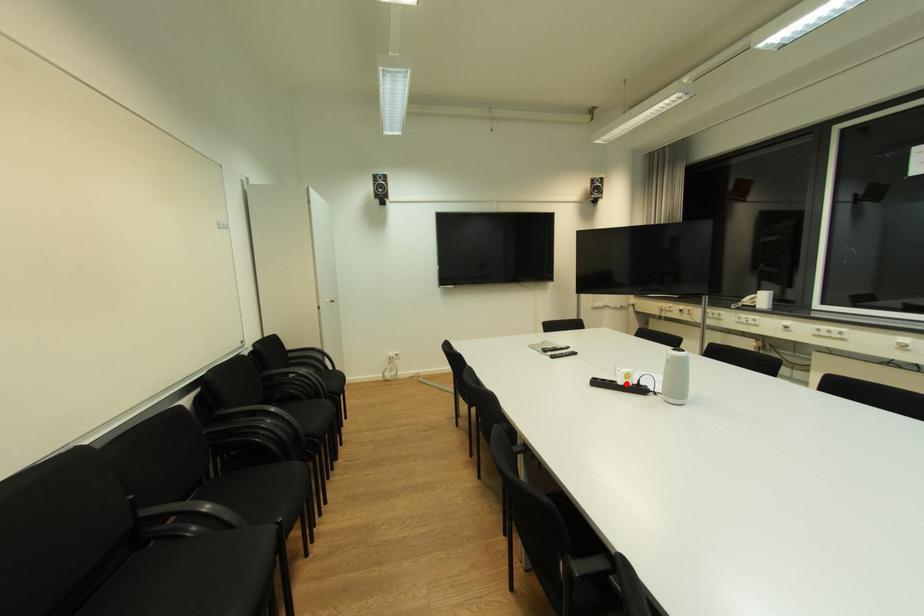
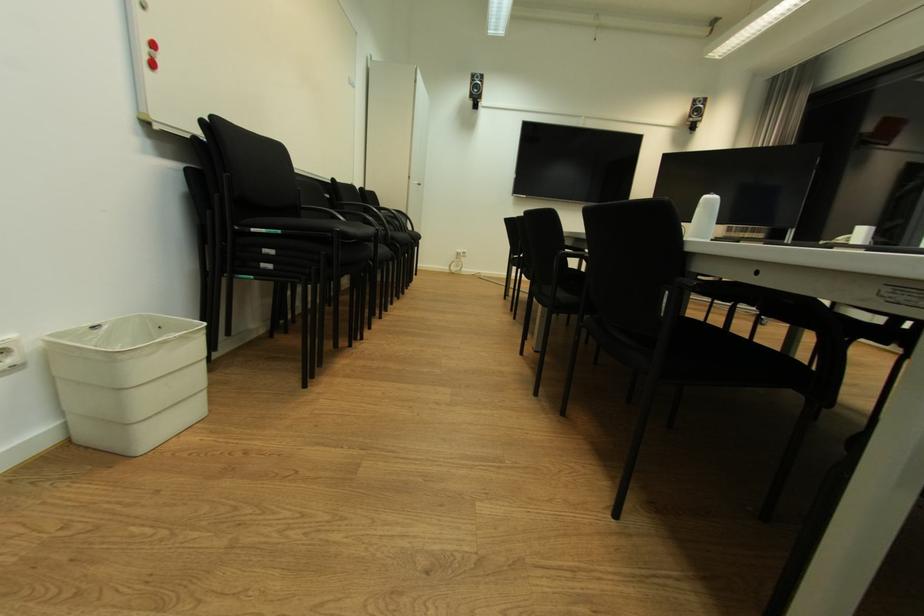
Question: I am providing you with two images of the same scene from different viewpoints. A red point is marked on the first image. Can you still see the location of the red point in image 2?

Choices:
 (A) Yes
 (B) No

Answer: (B)